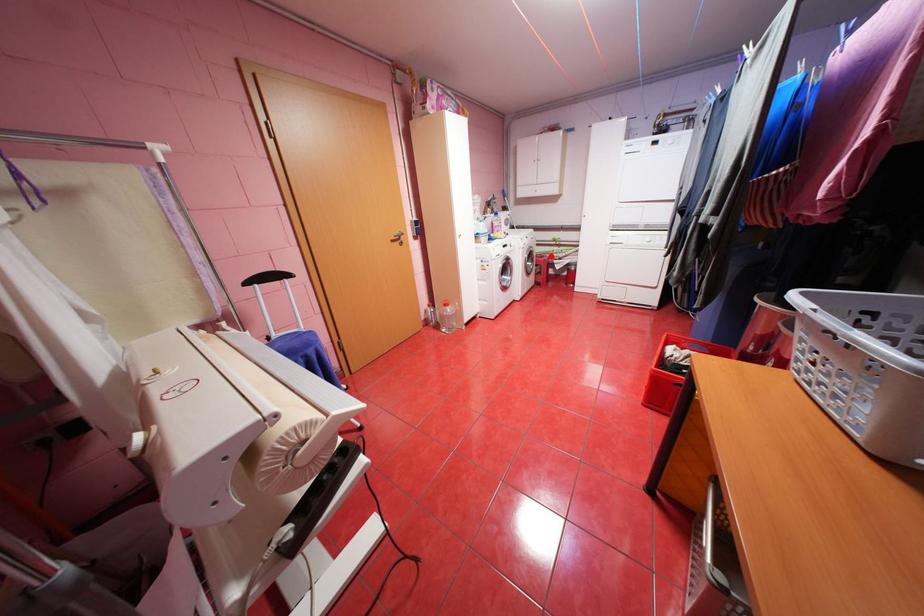
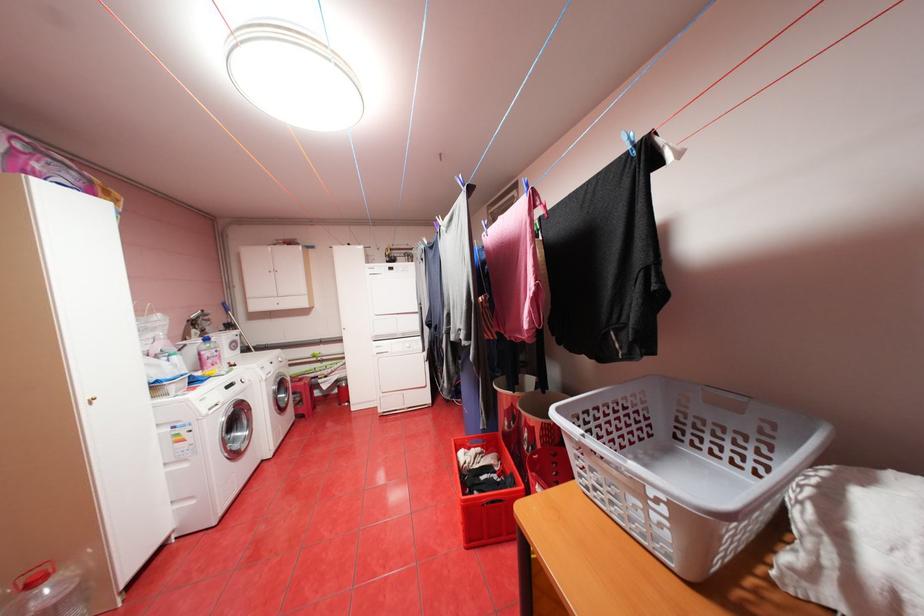
Question: I am providing you with two images of the same scene from different viewpoints. A red point is shown in image1. For the corresponding object point in image2, is it positioned nearer or farther from the camera?

Choices:
 (A) Nearer
 (B) Farther

Answer: (B)